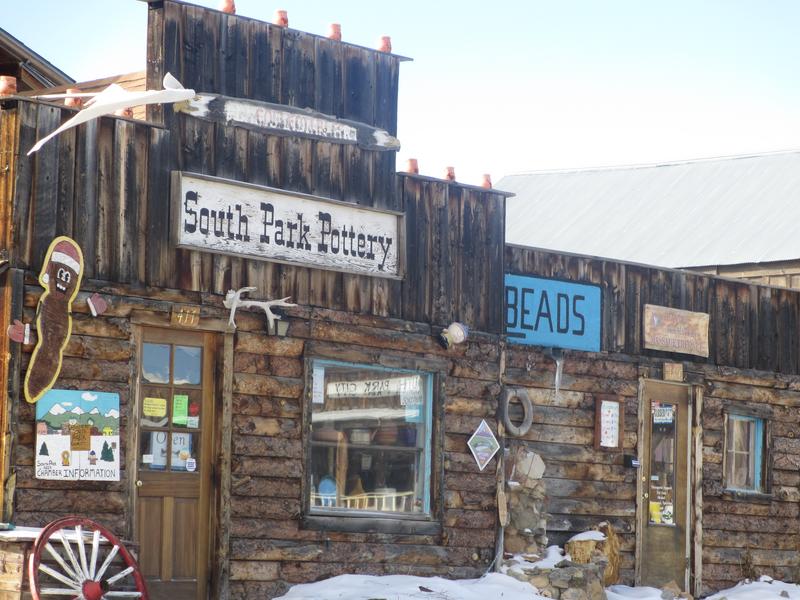
This screenshot has height=600, width=800. Identify the location of wooden door. (198, 500).